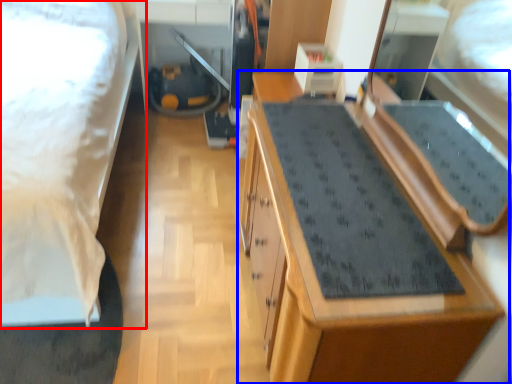
Question: Which object is further to the camera taking this photo, bed (highlighted by a red box) or cabinetry (highlighted by a blue box)?

Choices:
 (A) bed
 (B) cabinetry

Answer: (B)